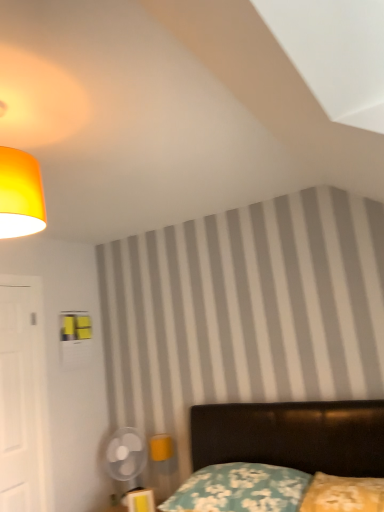
Question: Considering the relative sizes of yellow fabric pillow at lower right, the second pillow in the left-to-right sequence, and matte yellow lampshade at upper left in the image provided, is yellow fabric pillow at lower right, the second pillow in the left-to-right sequence, smaller than matte yellow lampshade at upper left?

Choices:
 (A) no
 (B) yes

Answer: (A)

Question: Is yellow fabric pillow at lower right, which is the first pillow in right-to-left order, positioned behind matte yellow lampshade at upper left?

Choices:
 (A) no
 (B) yes

Answer: (B)

Question: Does yellow fabric pillow at lower right, which is the first pillow in right-to-left order, appear on the left side of matte yellow lampshade at upper left?

Choices:
 (A) yes
 (B) no

Answer: (B)

Question: Is yellow fabric pillow at lower right, the second pillow in the left-to-right sequence, facing towards matte yellow lampshade at upper left?

Choices:
 (A) no
 (B) yes

Answer: (A)

Question: From a real-world perspective, is yellow fabric pillow at lower right, the second pillow in the left-to-right sequence, positioned over matte yellow lampshade at upper left based on gravity?

Choices:
 (A) no
 (B) yes

Answer: (A)

Question: Are yellow fabric pillow at lower right, the second pillow in the left-to-right sequence, and matte yellow lampshade at upper left making contact?

Choices:
 (A) no
 (B) yes

Answer: (A)

Question: Can you confirm if floral fabric pillow at lower center, which ranks as the 1th pillow in left-to-right order, is taller than yellow fabric pillow at lower right, which is the first pillow in right-to-left order?

Choices:
 (A) no
 (B) yes

Answer: (B)

Question: Would you say floral fabric pillow at lower center, which ranks as the 1th pillow in left-to-right order, is a long distance from yellow fabric pillow at lower right, which is the first pillow in right-to-left order?

Choices:
 (A) yes
 (B) no

Answer: (B)

Question: Is floral fabric pillow at lower center, which ranks as the 1th pillow in left-to-right order, thinner than yellow fabric pillow at lower right, the second pillow in the left-to-right sequence?

Choices:
 (A) no
 (B) yes

Answer: (A)

Question: Is floral fabric pillow at lower center, which ranks as the 2th pillow in right-to-left order, at the right side of yellow fabric pillow at lower right, which is the first pillow in right-to-left order?

Choices:
 (A) yes
 (B) no

Answer: (B)

Question: From the image's perspective, is floral fabric pillow at lower center, which ranks as the 2th pillow in right-to-left order, on yellow fabric pillow at lower right, which is the first pillow in right-to-left order?

Choices:
 (A) yes
 (B) no

Answer: (B)

Question: Is yellow fabric pillow at lower right, the second pillow in the left-to-right sequence, surrounded by floral fabric pillow at lower center, which ranks as the 1th pillow in left-to-right order?

Choices:
 (A) no
 (B) yes

Answer: (A)

Question: Is matte yellow lampshade at upper left positioned before velvet black bed at lower right?

Choices:
 (A) yes
 (B) no

Answer: (B)